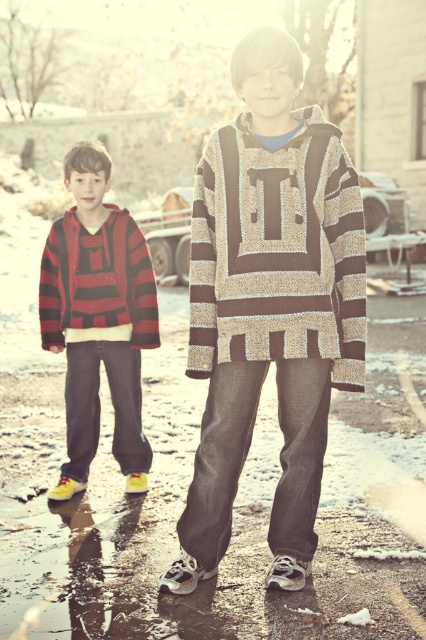
Is knitted wool poncho at center positioned behind knitted beige sweater at center?

No, it is not.

Who is more distant from viewer, (310, 330) or (296, 321)?

The point (310, 330) is behind.

Locate an element on the screen. The image size is (426, 640). knitted wool poncho at center is located at coordinates (270, 307).

Does knitted wool poncho at center have a lesser height compared to knitted wool sweater at left?

No, knitted wool poncho at center is not shorter than knitted wool sweater at left.

What do you see at coordinates (270, 307) in the screenshot?
I see `knitted wool poncho at center` at bounding box center [270, 307].

You are a GUI agent. You are given a task and a screenshot of the screen. Output one action in this format:
    pyautogui.click(x=<x>, y=<y>)
    Task: Click on the knitted wool poncho at center
    The image size is (426, 640).
    Given the screenshot: What is the action you would take?
    pyautogui.click(x=270, y=307)

Who is higher up, knitted wool sweater at left or red and black striped sweater at left?

red and black striped sweater at left

Which is more to the right, knitted wool sweater at left or red and black striped sweater at left?

knitted wool sweater at left is more to the right.

Is point (69, 227) positioned after point (101, 298)?

Yes.

Find the location of a particular element. This screenshot has width=426, height=640. knitted wool sweater at left is located at coordinates (97, 320).